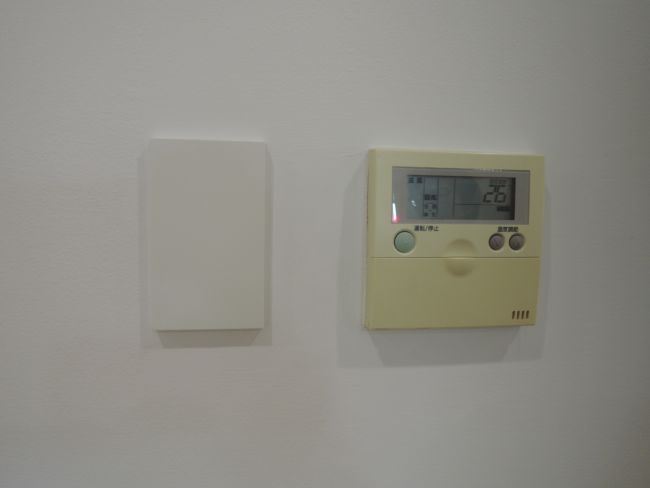
At what (x,y) coordinates should I click in order to perform the action: click on area where you open the thermostat. Please return your answer as a coordinate pair (x, y). This screenshot has width=650, height=488. Looking at the image, I should click on (459, 263).